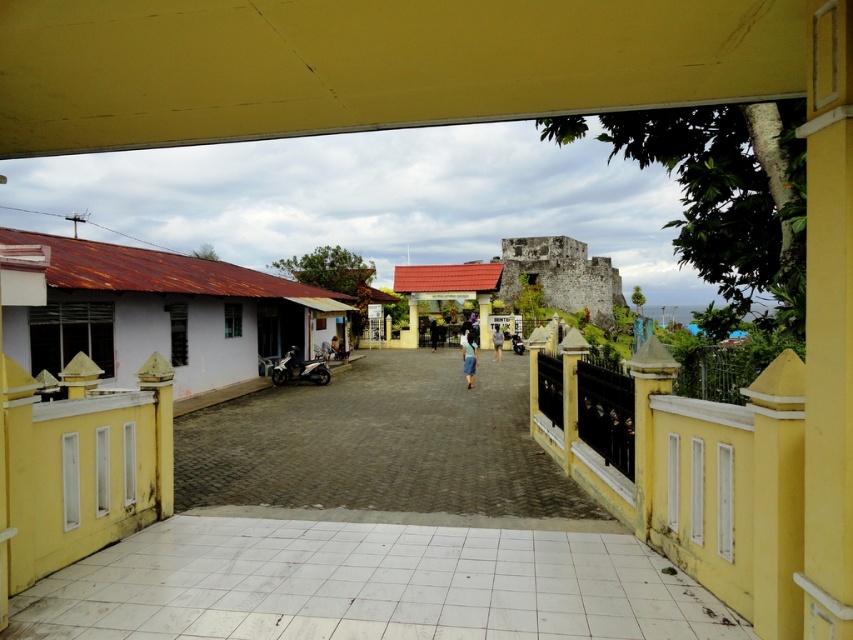
You are standing at the entrance of the courtyard through the yellow archway. You see the white tile path at center and the yellow painted stone pillar at right. Which object is closer to you?

The white tile path at center is closer to the viewer than the yellow painted stone pillar at right.

You are standing at the entrance of the yellow archway and want to walk towards the courtyard. Which object will you encounter first, the brown cobblestone alley at center or the blue fabric person at center?

The brown cobblestone alley at center is located below the blue fabric person at center, so you will encounter the blue fabric person at center first as you walk towards the courtyard.

You are a photographer standing in the courtyard. You see a light blue denim skirt at center and a shiny black motorcycle at center. Which object is taller?

The light blue denim skirt at center is taller than the shiny black motorcycle at center.